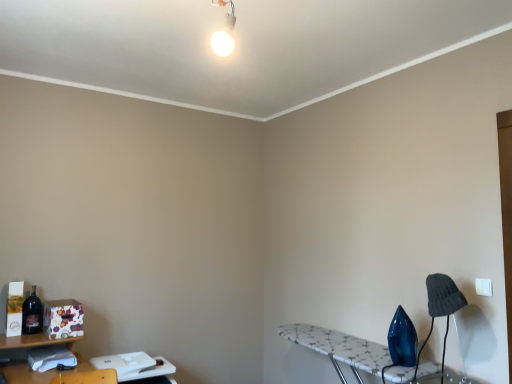
Question: From the image's perspective, is white glossy bulb at upper center positioned above or below white mosaic ironing board at lower right, positioned as the first table in right-to-left order?

Choices:
 (A) below
 (B) above

Answer: (B)

Question: In terms of height, does white glossy bulb at upper center look taller or shorter compared to white mosaic ironing board at lower right, positioned as the first table in right-to-left order?

Choices:
 (A) tall
 (B) short

Answer: (B)

Question: Which object is positioned closest to the white plastic table at lower left, which is the 2th table from right to left?

Choices:
 (A) white glossy bulb at upper center
 (B) dark gray fabric lampshade at lower right
 (C) white mosaic ironing board at lower right, the second table from the left
 (D) matte dark blue bottle at left

Answer: (D)

Question: Which object is the closest to the white glossy bulb at upper center?

Choices:
 (A) dark gray fabric lampshade at lower right
 (B) white mosaic ironing board at lower right, positioned as the first table in right-to-left order
 (C) white plastic table at lower left, which is counted as the 1th table, starting from the left
 (D) matte dark blue bottle at left

Answer: (A)